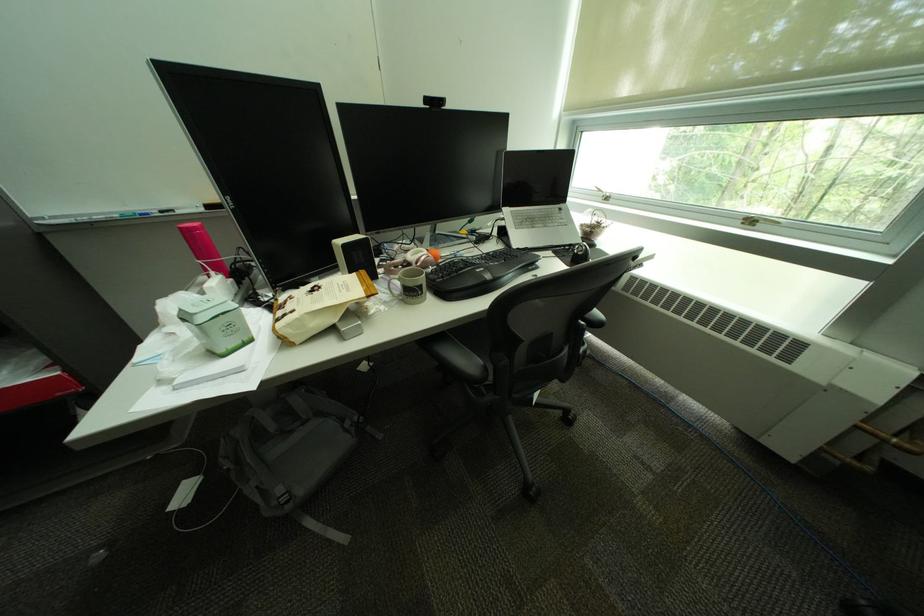
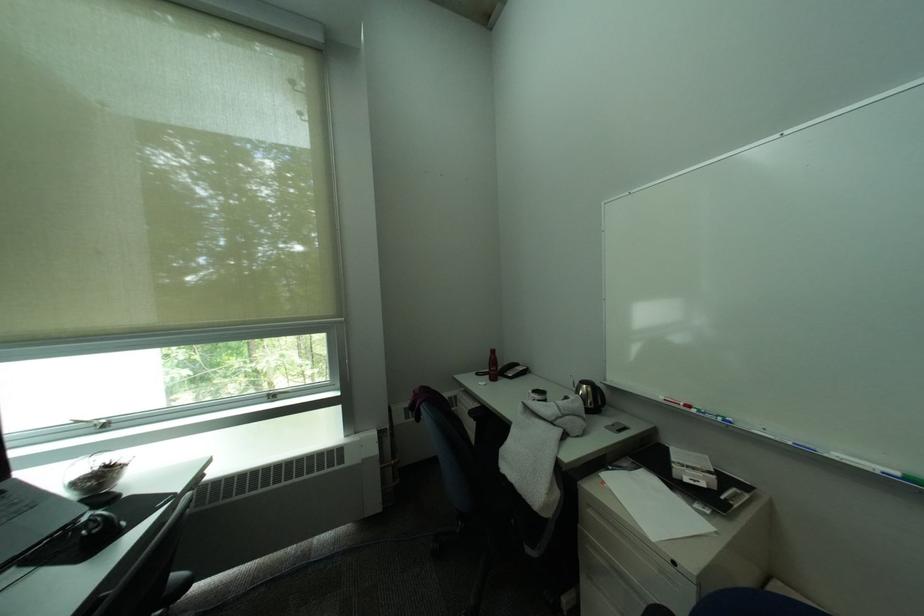
Locate, in the second image, the point that corresponds to pixel 591 252 in the first image.

(106, 528)